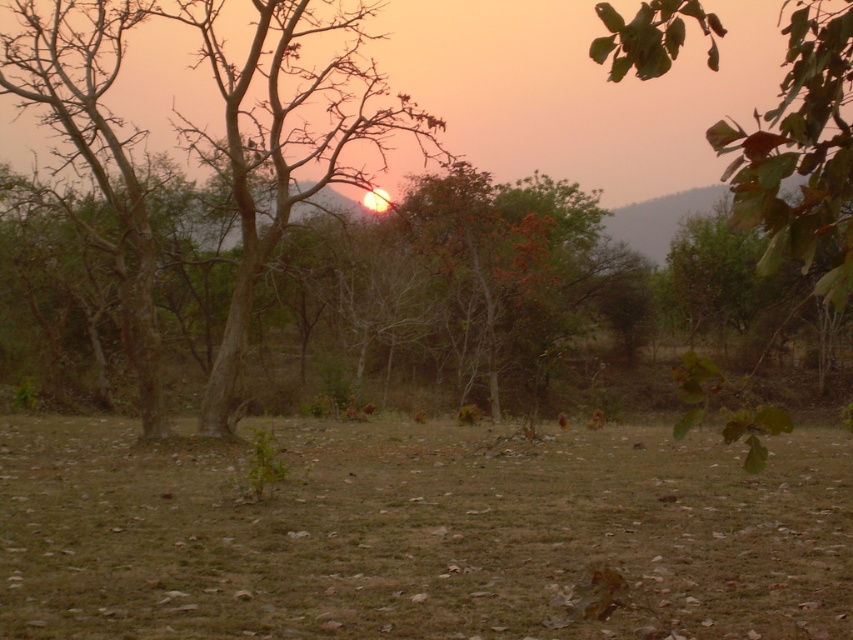
You are standing at the point labeled as point (421, 536) in the image. Looking around, you notice brown grass at center. Which direction should you walk to reach the trees in the middle ground?

Since point (421, 536) is on brown grass at center, you should walk forward towards the middle ground where the trees are located.